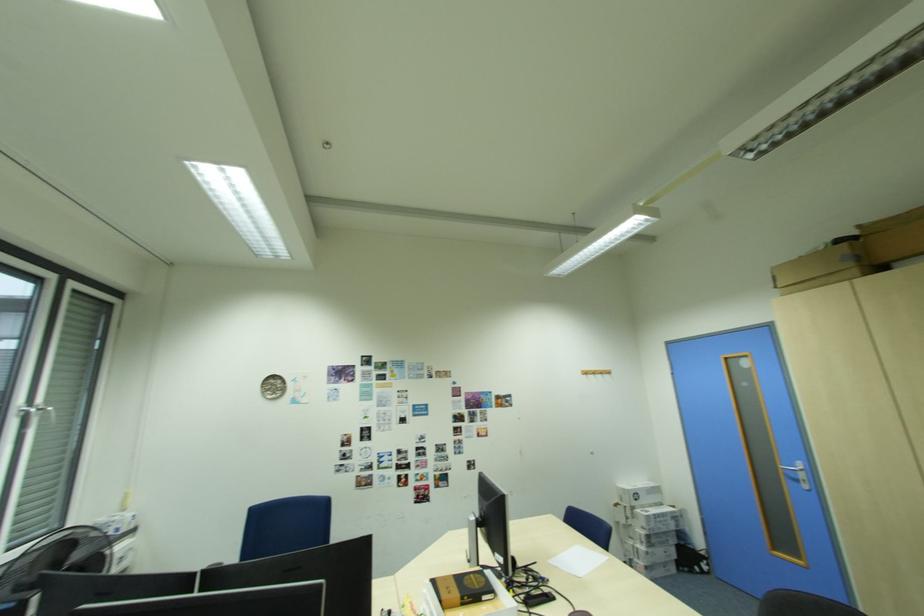
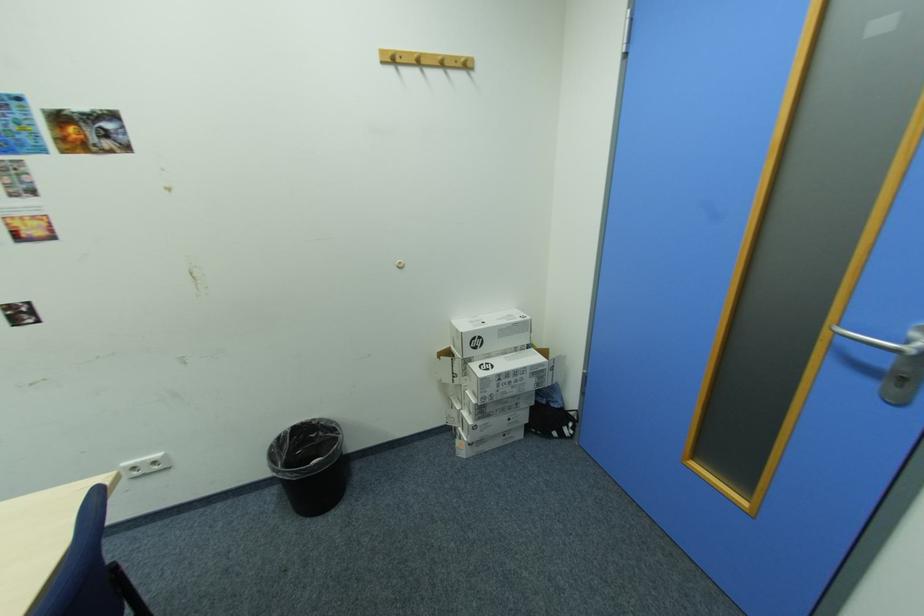
Question: I am providing you with two images of the same scene from different viewpoints. Please identify which objects are invisible in image2.

Choices:
 (A) white paper box
 (B) black trash can
 (C) wooden coat hook
 (D) none of these

Answer: (D)